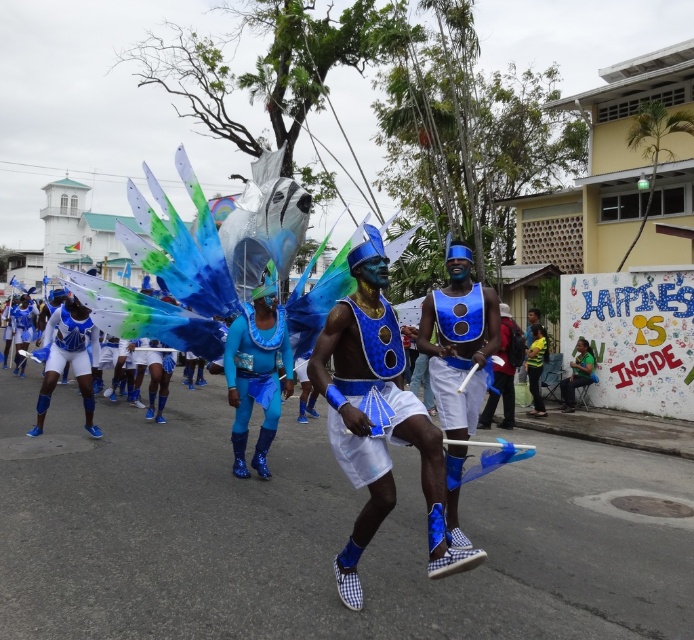
Question: Does matte blue costume at center have a greater width compared to matte blue fabric at center?

Choices:
 (A) yes
 (B) no

Answer: (A)

Question: Which of the following is the farthest from the observer?

Choices:
 (A) (362, 452)
 (B) (432, 390)

Answer: (B)

Question: Is matte blue costume at center smaller than matte blue fabric at center?

Choices:
 (A) yes
 (B) no

Answer: (B)

Question: Which point is farther to the camera?

Choices:
 (A) matte blue fabric at center
 (B) matte blue costume at center

Answer: (A)

Question: Can you confirm if matte blue costume at center is positioned to the left of matte blue fabric at center?

Choices:
 (A) yes
 (B) no

Answer: (A)